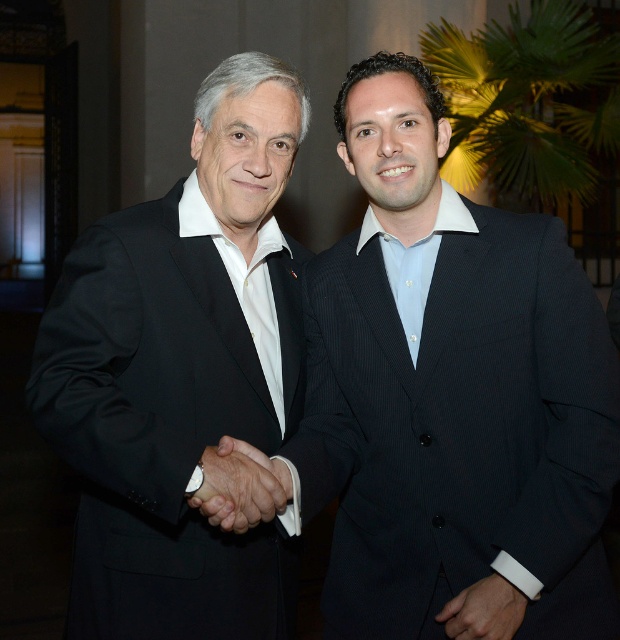
Find the location of a particular element. This screenshot has height=640, width=620. black matte suit at left is located at coordinates (x=184, y=378).

Can you confirm if black matte suit at left is thinner than white leather wristband at center?

No.

Does point (291, 106) lie behind point (494, 625)?

Yes, point (291, 106) is behind point (494, 625).

The width and height of the screenshot is (620, 640). Identify the location of black matte suit at left. (184, 378).

Between black pinstripe suit at center and black matte suit at left, which one appears on the left side from the viewer's perspective?

From the viewer's perspective, black matte suit at left appears more on the left side.

Is black pinstripe suit at center above black matte suit at left?

No.

I want to click on black pinstripe suit at center, so tap(451, 390).

Identify the location of black pinstripe suit at center. (451, 390).

Which is more to the right, black pinstripe suit at center or black matte hand at center?

Positioned to the right is black pinstripe suit at center.

Between black pinstripe suit at center and black matte hand at center, which one has more height?

black pinstripe suit at center is taller.

Between point (432, 604) and point (290, 481), which one is positioned behind?

Point (432, 604)

You are a GUI agent. You are given a task and a screenshot of the screen. Output one action in this format:
    pyautogui.click(x=<x>, y=<y>)
    Task: Click on the black pinstripe suit at center
    
    Given the screenshot: What is the action you would take?
    pyautogui.click(x=451, y=390)